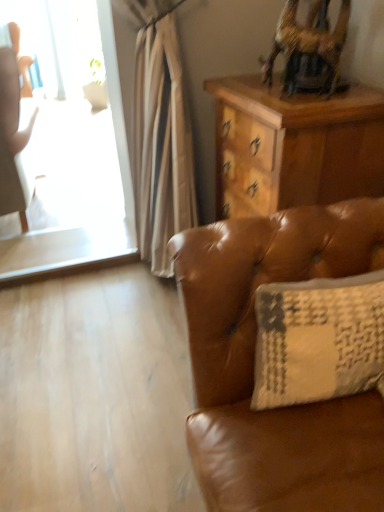
Question: Is wooden desk at upper right inside wooden swivel chair at upper right?

Choices:
 (A) no
 (B) yes

Answer: (A)

Question: Is wooden swivel chair at upper right facing towards wooden desk at upper right?

Choices:
 (A) yes
 (B) no

Answer: (B)

Question: Is wooden swivel chair at upper right thinner than wooden desk at upper right?

Choices:
 (A) no
 (B) yes

Answer: (B)

Question: Does wooden swivel chair at upper right have a greater height compared to wooden desk at upper right?

Choices:
 (A) yes
 (B) no

Answer: (B)

Question: Would you consider wooden swivel chair at upper right to be distant from wooden desk at upper right?

Choices:
 (A) yes
 (B) no

Answer: (B)

Question: Does wooden swivel chair at upper right come in front of wooden desk at upper right?

Choices:
 (A) no
 (B) yes

Answer: (B)

Question: Is wooden swivel chair at upper right taller than beige textured pillow at right?

Choices:
 (A) yes
 (B) no

Answer: (B)

Question: Can you confirm if wooden swivel chair at upper right is smaller than beige textured pillow at right?

Choices:
 (A) yes
 (B) no

Answer: (A)

Question: From a real-world perspective, is wooden swivel chair at upper right located beneath beige textured pillow at right?

Choices:
 (A) yes
 (B) no

Answer: (B)

Question: Is wooden swivel chair at upper right positioned far away from beige textured pillow at right?

Choices:
 (A) yes
 (B) no

Answer: (B)

Question: Is wooden swivel chair at upper right thinner than beige textured pillow at right?

Choices:
 (A) yes
 (B) no

Answer: (A)

Question: Considering the relative sizes of wooden swivel chair at upper right and beige textured pillow at right in the image provided, is wooden swivel chair at upper right wider than beige textured pillow at right?

Choices:
 (A) yes
 (B) no

Answer: (B)

Question: Is matte white chair at left positioned with its back to wooden desk at upper right?

Choices:
 (A) yes
 (B) no

Answer: (B)